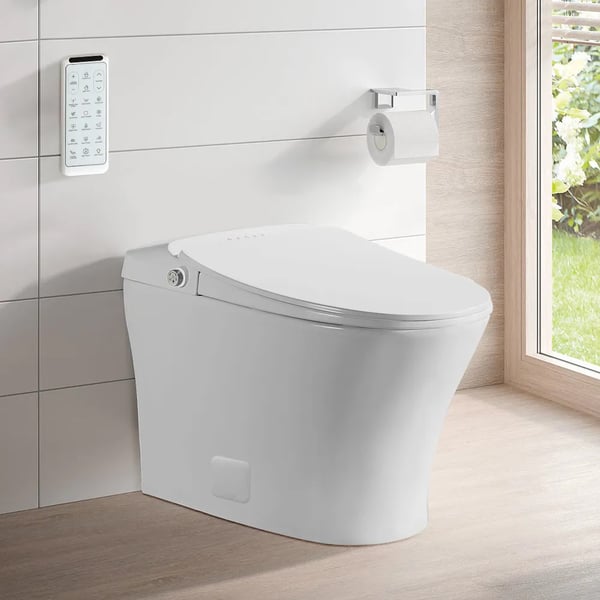
The width and height of the screenshot is (600, 600). I want to click on in front of toilet, so click(x=438, y=560).